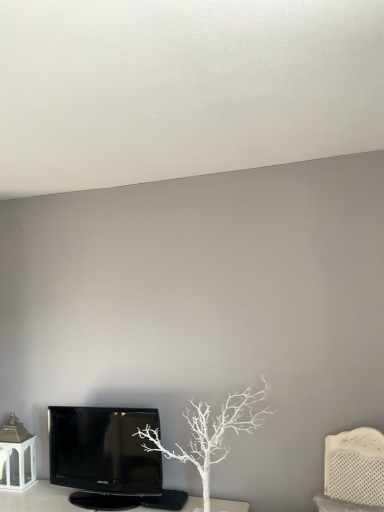
Question: Relative to black glossy television at lower left, is white textured headboard at right in front or behind?

Choices:
 (A) front
 (B) behind

Answer: (A)

Question: Looking at their shapes, would you say white textured headboard at right is wider or thinner than black glossy television at lower left?

Choices:
 (A) thin
 (B) wide

Answer: (A)

Question: Which is nearer to the white matte tree at center?

Choices:
 (A) white textured headboard at right
 (B) black glossy television at lower left

Answer: (B)

Question: Which of these objects is positioned closest to the white textured headboard at right?

Choices:
 (A) white matte tree at center
 (B) black glossy television at lower left

Answer: (A)